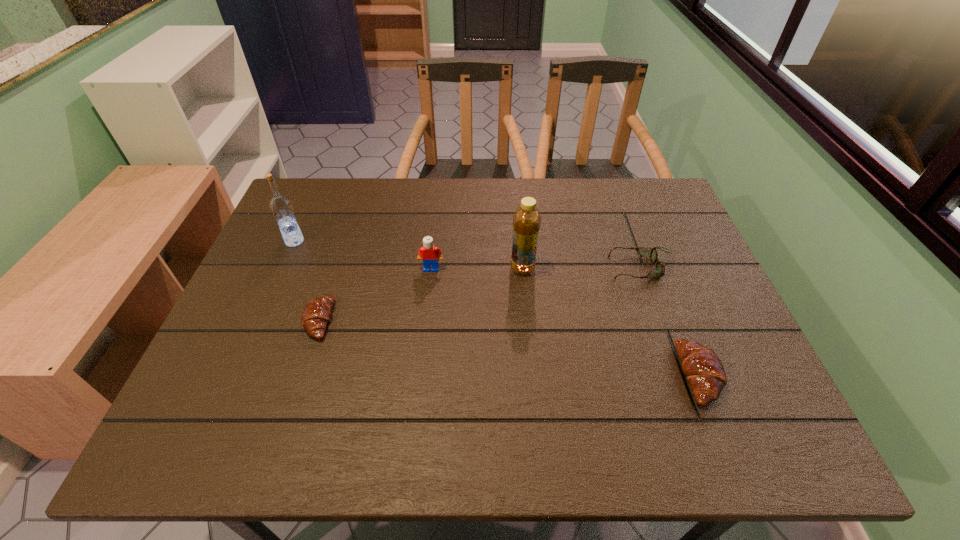
In order to click on free space between the nearest object and the left crescent roll in this screenshot , I will do 509,347.

Where is `free space between the vodka and the fifth object from right to left`? This screenshot has height=540, width=960. free space between the vodka and the fifth object from right to left is located at coordinates (306, 280).

Locate an element on the screen. Image resolution: width=960 pixels, height=540 pixels. empty space between the taller crescent roll and the third tallest object is located at coordinates (565, 322).

This screenshot has width=960, height=540. What are the coordinates of `free space between the farthest object and the Lego` in the screenshot? It's located at (363, 255).

I want to click on free spot between the taller crescent roll and the third tallest object, so click(x=565, y=322).

The height and width of the screenshot is (540, 960). In order to click on free space between the vodka and the spectacles in this screenshot , I will do `click(468, 254)`.

Where is `free point between the spectacles and the leftmost object`? This screenshot has width=960, height=540. free point between the spectacles and the leftmost object is located at coordinates pyautogui.click(x=468, y=254).

The height and width of the screenshot is (540, 960). Identify the location of object that is the fourth closest to the second object from left to right. (659, 270).

The width and height of the screenshot is (960, 540). I want to click on object that is the fourth closest to the fourth object from right to left, so click(x=659, y=270).

At what (x,y) coordinates should I click in order to perform the action: click on free space that satisfies the following two spatial constraints: 1. on the face of the taller crescent roll; 2. on the left side of the Lego. Please return your answer as a coordinate pair (x, y). Looking at the image, I should click on (420, 375).